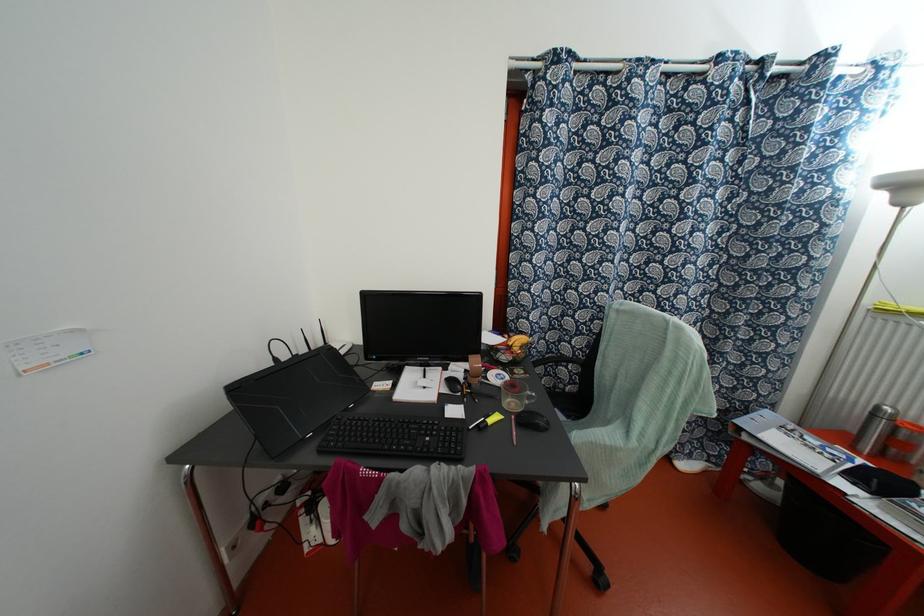
This screenshot has width=924, height=616. I want to click on glass cup handle, so click(517, 400).